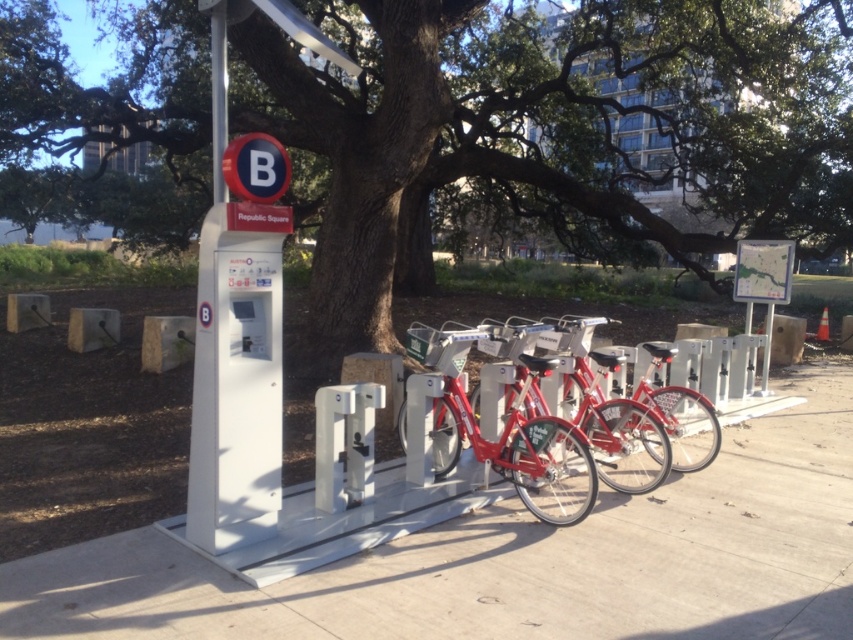
Who is lower down, metallic circular sign at upper center or metallic pole at upper center?

Positioned lower is metallic circular sign at upper center.

Identify the location of metallic circular sign at upper center. Image resolution: width=853 pixels, height=640 pixels. (256, 168).

Can you confirm if white matte pavement at center is positioned above metallic pole at upper center?

No, white matte pavement at center is not above metallic pole at upper center.

Can you confirm if white matte pavement at center is smaller than metallic pole at upper center?

Yes.

Describe the element at coordinates (519, 561) in the screenshot. This screenshot has height=640, width=853. I see `white matte pavement at center` at that location.

Where is `white matte pavement at center`? The height and width of the screenshot is (640, 853). white matte pavement at center is located at coordinates (519, 561).

Does green leafy tree at center appear on the right side of white matte pavement at center?

In fact, green leafy tree at center is to the left of white matte pavement at center.

The height and width of the screenshot is (640, 853). In order to click on green leafy tree at center in this screenshot , I will do `click(553, 129)`.

Locate an element on the screen. The height and width of the screenshot is (640, 853). green leafy tree at center is located at coordinates (553, 129).